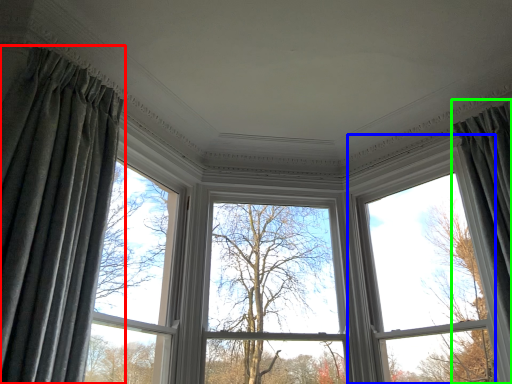
Question: Which object is positioned farthest from curtain (highlighted by a red box)? Select from bay window (highlighted by a blue box) and curtain (highlighted by a green box).

Choices:
 (A) bay window
 (B) curtain

Answer: (B)